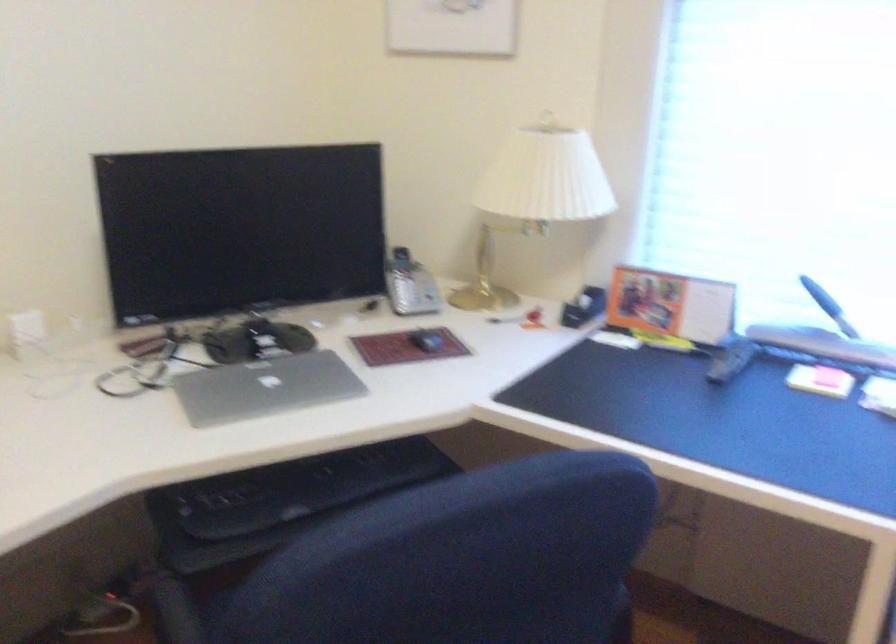
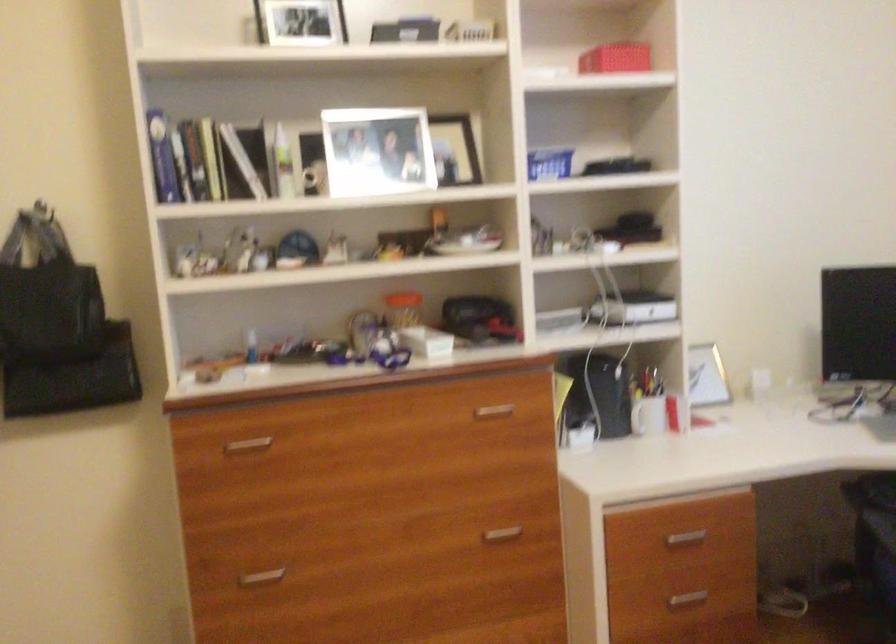
Question: How did the camera likely rotate?

Choices:
 (A) Left
 (B) Right
 (C) Up
 (D) Down

Answer: (A)